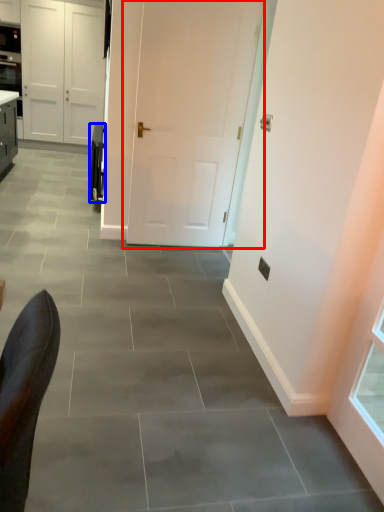
Question: Which of the following is the farthest to the observer, door (highlighted by a red box) or appliance (highlighted by a blue box)?

Choices:
 (A) door
 (B) appliance

Answer: (B)